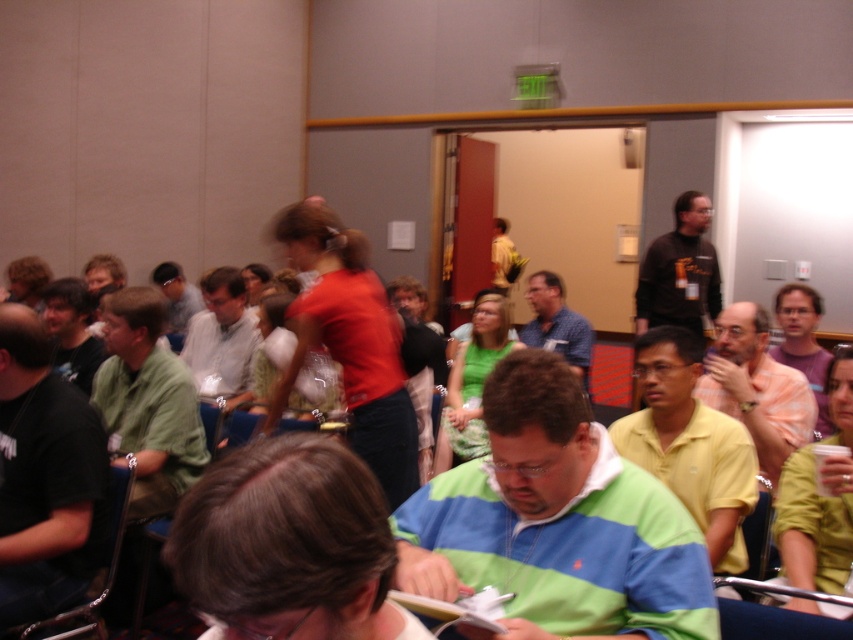
Question: Estimate the real-world distances between objects in this image. Which object is farther from the matte white shirt at center?

Choices:
 (A) light yellow shirt at center
 (B) green striped shirt at center
 (C) blue shirt at center

Answer: (B)

Question: Which point is farther to the camera?

Choices:
 (A) light yellow shirt at center
 (B) green matte shirt at left
 (C) yellow matte shirt at center
 (D) dark brown sweater at upper right

Answer: (D)

Question: Is green striped sweater at center below blue shirt at center?

Choices:
 (A) yes
 (B) no

Answer: (A)

Question: Does yellow matte shirt at center have a smaller size compared to matte white shirt at center?

Choices:
 (A) yes
 (B) no

Answer: (A)

Question: Does light yellow shirt at center appear on the right side of matte white shirt at center?

Choices:
 (A) yes
 (B) no

Answer: (A)

Question: Which point is farther from the camera taking this photo?

Choices:
 (A) (811, 404)
 (B) (173, 262)

Answer: (B)